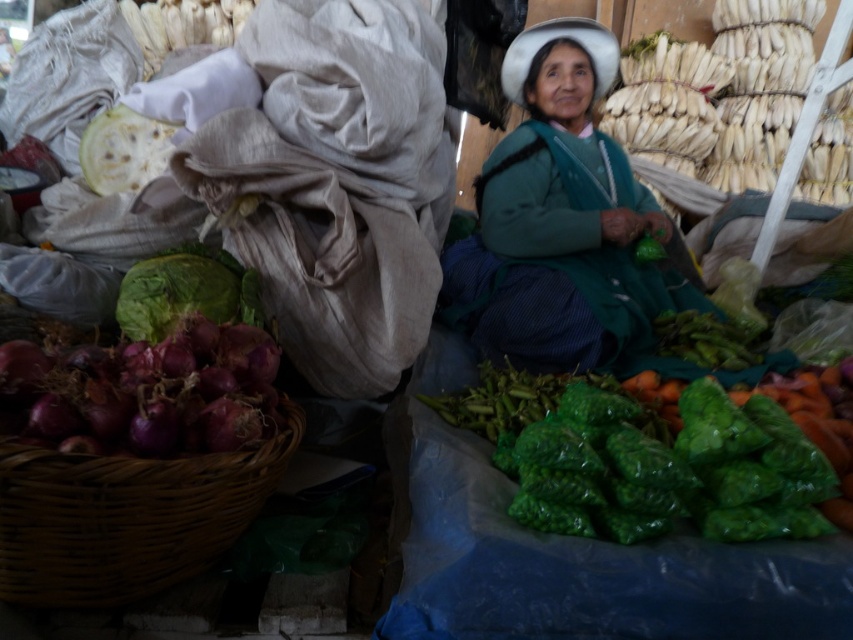
From the picture: You are a customer at the market stall and want to buy both the brown wicker basket at lower left and the green leafy vegetable at left. Which item is bigger in size?

The brown wicker basket at lower left is larger in size than the green leafy vegetable at left.

You are a customer at the market stall and want to pick up an item. You notice two points marked in the scene. The first point is at coordinate point [613,328] and the second is at point [250,374]. Which point is closer to you?

Point [250,374] is closer to you because the description states that point [613,328] is further to the camera than point [250,374].